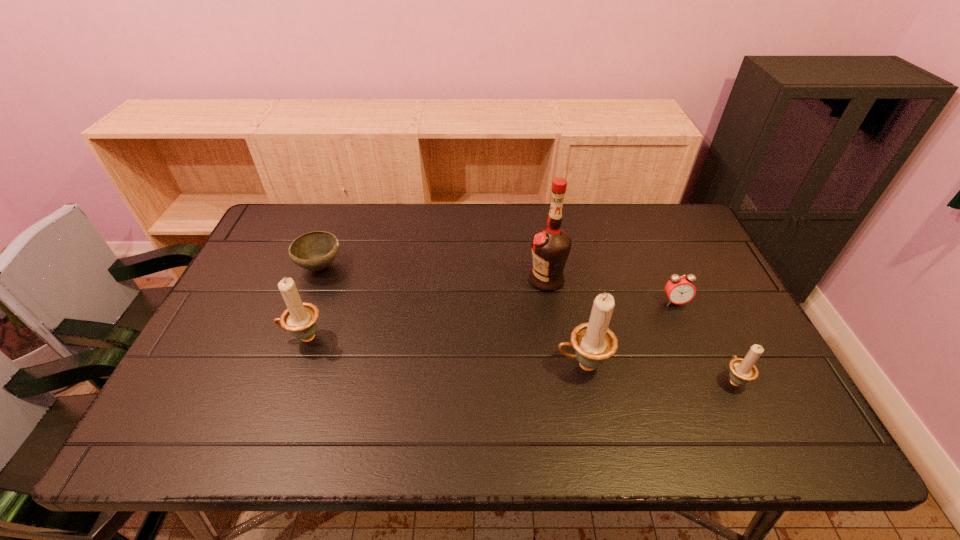
Find the location of a particular element. vacant point located between the bowl and the fourth tallest object is located at coordinates (527, 323).

Find the location of a particular element. The height and width of the screenshot is (540, 960). free space between the tallest object and the bowl is located at coordinates (433, 273).

This screenshot has width=960, height=540. I want to click on object that is the second closest to the bowl, so click(551, 246).

This screenshot has height=540, width=960. What are the coordinates of `the third closest object relative to the bowl` in the screenshot? It's located at (593, 341).

Image resolution: width=960 pixels, height=540 pixels. What are the coordinates of `candle_holder that stands as the third closest to the fourth nearest object` in the screenshot? It's located at (299, 318).

Locate which candle_holder is the second closest to the alarm clock. Please provide its 2D coordinates. Your answer should be formatted as a tuple, i.e. [(x, y)], where the tuple contains the x and y coordinates of a point satisfying the conditions above.

[(593, 341)]

Where is `free space that satisfies the following two spatial constraints: 1. on the handle side of the second candle_holder from left to right; 2. on the handle side of the rightmost candle_holder`? free space that satisfies the following two spatial constraints: 1. on the handle side of the second candle_holder from left to right; 2. on the handle side of the rightmost candle_holder is located at coordinates (586, 380).

You are a GUI agent. You are given a task and a screenshot of the screen. Output one action in this format:
    pyautogui.click(x=<x>, y=<y>)
    Task: Click on the vacant region that satisfies the following two spatial constraints: 1. on the front and back of the liquor; 2. on the handle side of the fourth tallest object
    
    Given the screenshot: What is the action you would take?
    pyautogui.click(x=562, y=380)

Identify the location of vacant point that satisfies the following two spatial constraints: 1. on the front and back of the tallest object; 2. on the handle side of the rightmost candle_holder. Image resolution: width=960 pixels, height=540 pixels. (562, 380).

What are the coordinates of `free point that satisfies the following two spatial constraints: 1. on the handle side of the fourth tallest object; 2. on the handle side of the leftmost candle_holder` in the screenshot? It's located at (713, 338).